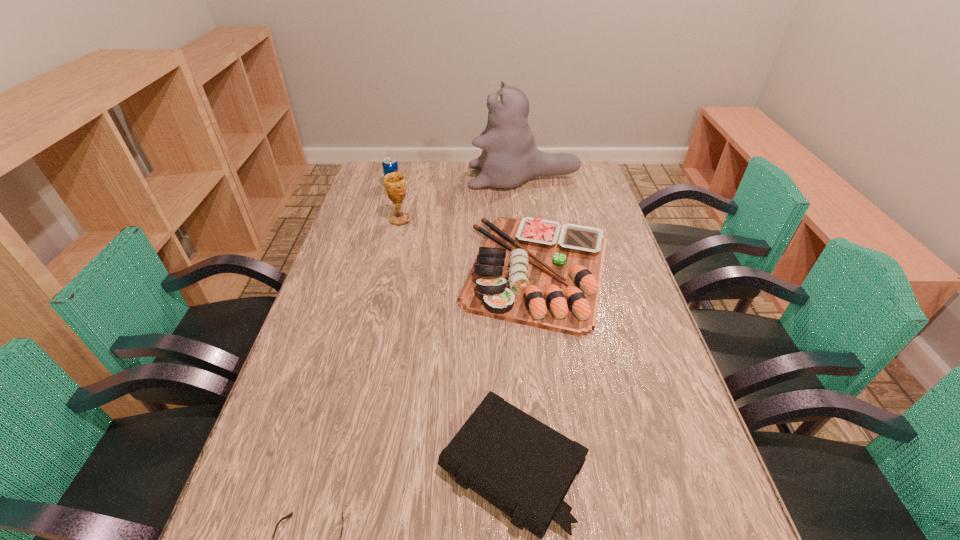
Image resolution: width=960 pixels, height=540 pixels. I want to click on cat that is positioned at the far edge, so click(x=509, y=157).

The width and height of the screenshot is (960, 540). I want to click on pop soda present at the far edge, so click(x=390, y=165).

This screenshot has width=960, height=540. Find the location of `chalice present at the left edge`. chalice present at the left edge is located at coordinates (395, 186).

Locate an element on the screen. pop soda located in the left edge section of the desktop is located at coordinates (390, 165).

The width and height of the screenshot is (960, 540). I want to click on cat that is at the right edge, so click(509, 157).

The height and width of the screenshot is (540, 960). In order to click on platter that is at the right edge in this screenshot , I will do `click(531, 271)`.

This screenshot has width=960, height=540. In order to click on object that is at the far left corner in this screenshot , I will do `click(390, 165)`.

Find the location of a particular element. This screenshot has width=960, height=540. object at the far right corner is located at coordinates (509, 157).

The width and height of the screenshot is (960, 540). Find the location of `free space at the far edge of the desktop`. free space at the far edge of the desktop is located at coordinates (414, 164).

The height and width of the screenshot is (540, 960). Identify the location of vacant space at the left edge of the desktop. (x=353, y=281).